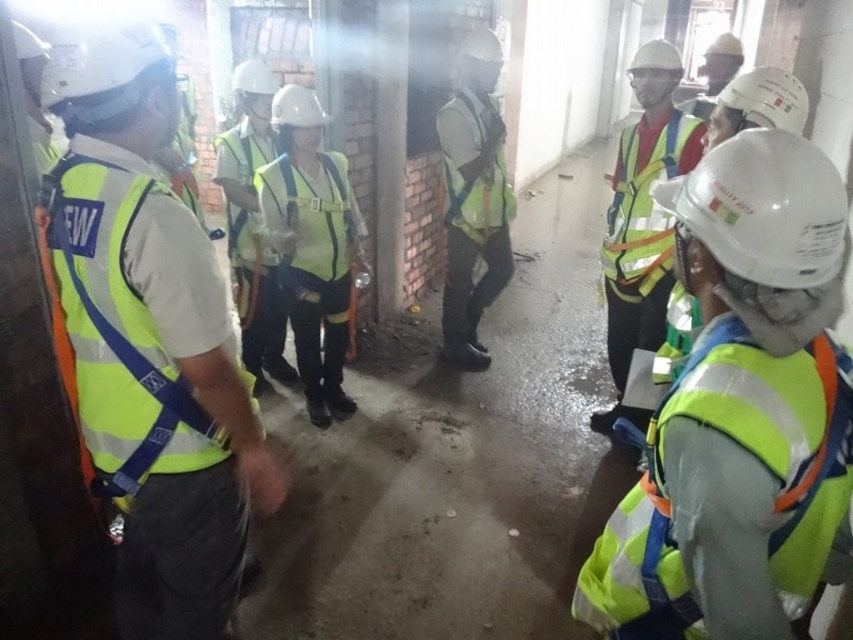
Who is lower down, neon yellow reflective vest at left or yellow reflective safety vest at center?

neon yellow reflective vest at left is below.

I want to click on neon yellow reflective vest at left, so click(152, 348).

Between yellow reflective safety vest at center and high-visibility fabric safety vest at center, which one has more height?

With more height is high-visibility fabric safety vest at center.

Does yellow reflective safety vest at center have a lesser width compared to high-visibility fabric safety vest at center?

Incorrect, yellow reflective safety vest at center's width is not less than high-visibility fabric safety vest at center's.

Between point (350, 212) and point (229, 131), which one is positioned in front?

Point (350, 212) is in front.

Find the location of a particular element. The image size is (853, 640). yellow reflective safety vest at center is located at coordinates (309, 214).

Can you confirm if yellow reflective vest at center is positioned to the left of reflective yellow safety vest at right?

Correct, you'll find yellow reflective vest at center to the left of reflective yellow safety vest at right.

Can you confirm if yellow reflective vest at center is wider than reflective yellow safety vest at right?

Yes.

Does point (308, 145) come behind point (619, 164)?

No, (308, 145) is in front of (619, 164).

Where is `yellow reflective vest at center`? yellow reflective vest at center is located at coordinates (312, 244).